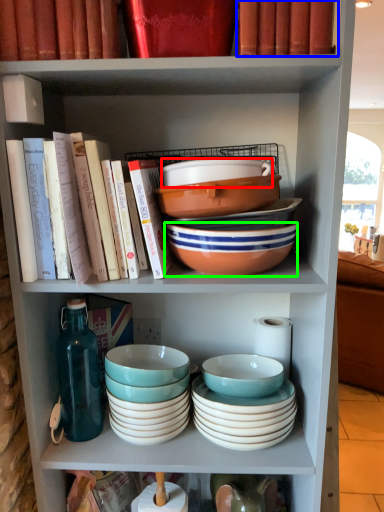
Question: Which object is positioned closest to bowl (highlighted by a red box)? Select from book (highlighted by a blue box) and bowl (highlighted by a green box).

Choices:
 (A) book
 (B) bowl

Answer: (B)